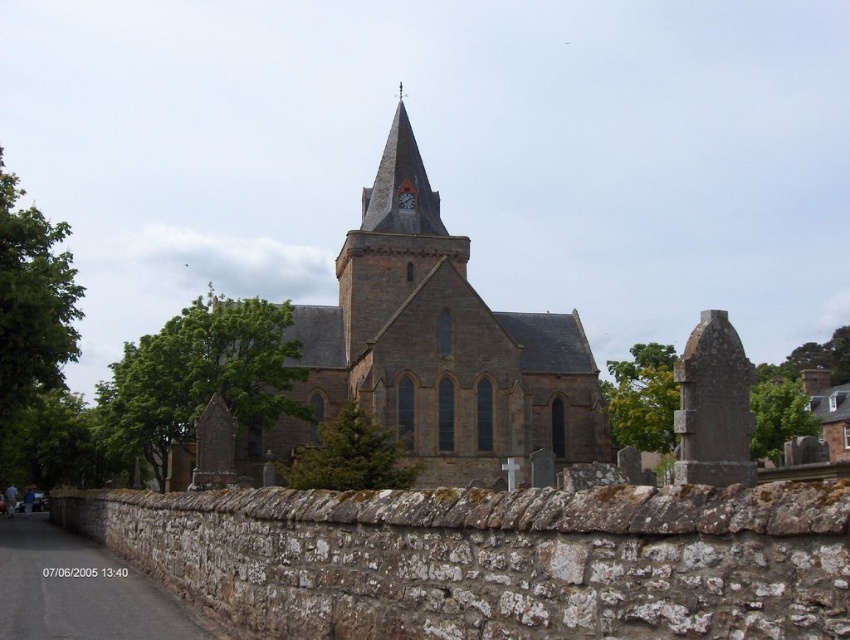
Is brown stone church at center wider than matte stone clock at upper center?

Correct, the width of brown stone church at center exceeds that of matte stone clock at upper center.

Does brown stone church at center appear on the left side of matte stone clock at upper center?

Yes, brown stone church at center is to the left of matte stone clock at upper center.

Who is more forward, (384,420) or (401,196)?

Point (384,420) is in front.

You are a GUI agent. You are given a task and a screenshot of the screen. Output one action in this format:
    pyautogui.click(x=<x>, y=<y>)
    Task: Click on the brown stone church at center
    The height and width of the screenshot is (640, 850).
    Given the screenshot: What is the action you would take?
    pyautogui.click(x=434, y=348)

Is brown stone church at center bigger than brick steeple at center?

Yes, brown stone church at center is bigger than brick steeple at center.

Which is above, brown stone church at center or brick steeple at center?

brick steeple at center is higher up.

Is point (400, 426) positioned after point (377, 200)?

No, (400, 426) is in front of (377, 200).

The image size is (850, 640). What are the coordinates of `brown stone church at center` in the screenshot? It's located at (434, 348).

Does brick steeple at center have a lesser height compared to matte stone clock at upper center?

No.

Is brick steeple at center below matte stone clock at upper center?

Incorrect, brick steeple at center is not positioned below matte stone clock at upper center.

Is point (381, 204) closer to viewer compared to point (408, 204)?

That is True.

This screenshot has width=850, height=640. Find the location of `brick steeple at center`. brick steeple at center is located at coordinates (400, 186).